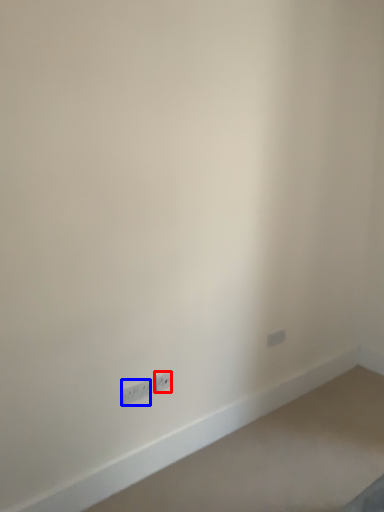
Question: Among these objects, which one is farthest to the camera, power plugs and sockets (highlighted by a red box) or power plugs and sockets (highlighted by a blue box)?

Choices:
 (A) power plugs and sockets
 (B) power plugs and sockets

Answer: (A)